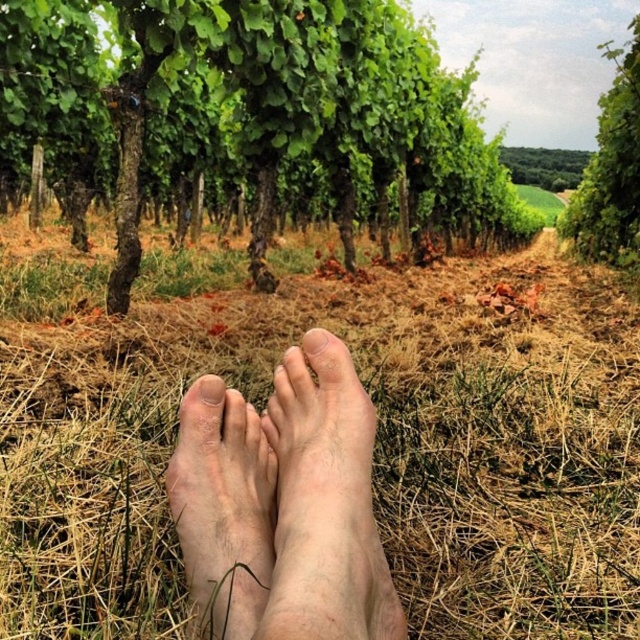
You are an artist planning to paint the vineyard scene. You want to emphasize the scale of the green leafy tree at upper right compared to the green leafy tree at upper center. Which tree should you paint larger in your artwork?

You should paint the green leafy tree at upper right larger than the green leafy tree at upper center because the green leafy tree at upper right is bigger than green leafy tree at upper center.

You are standing in a vineyard and see the pale skin barefoot at center. Where exactly would you find this barefoot in terms of coordinates?

The pale skin barefoot at center is located at coordinates point [324,506].

You are a hiker who has just finished a long trek and wants to rest. You see the pale skin barefoot at center and the green leafy tree at upper right. How far apart are these two objects?

The pale skin barefoot at center and the green leafy tree at upper right are 7.11 meters apart from each other.